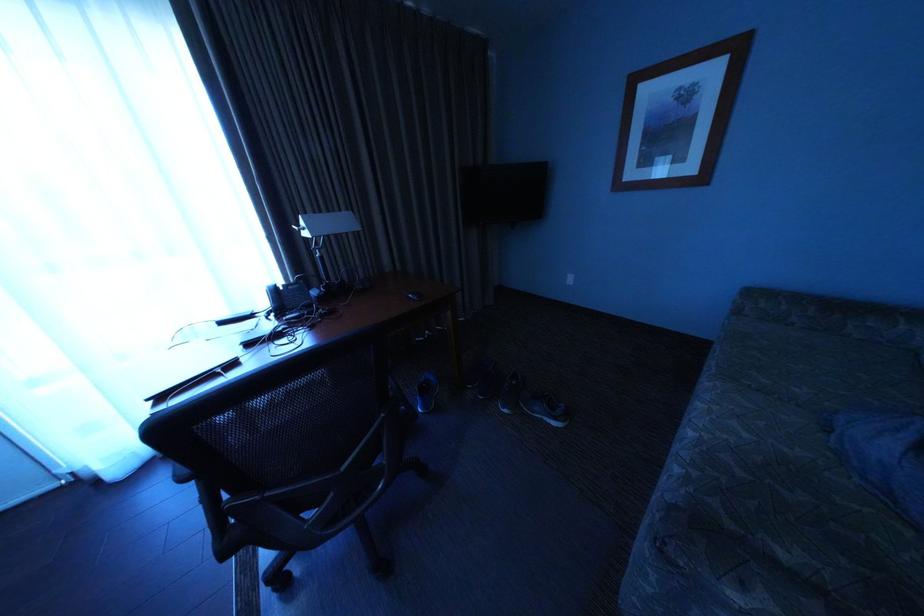
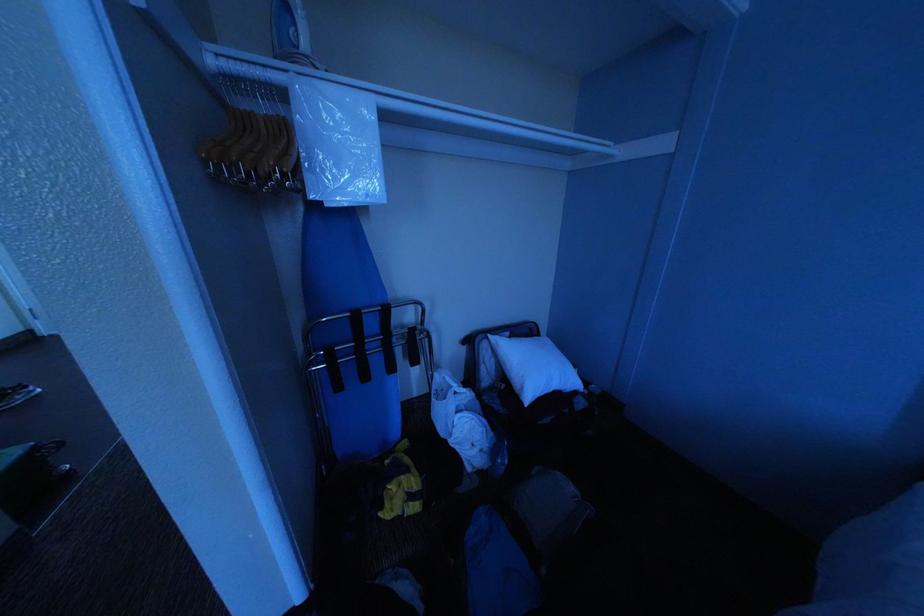
Which direction would the cameraman need to move to produce the second image?

The cameraman moved toward right, backward.